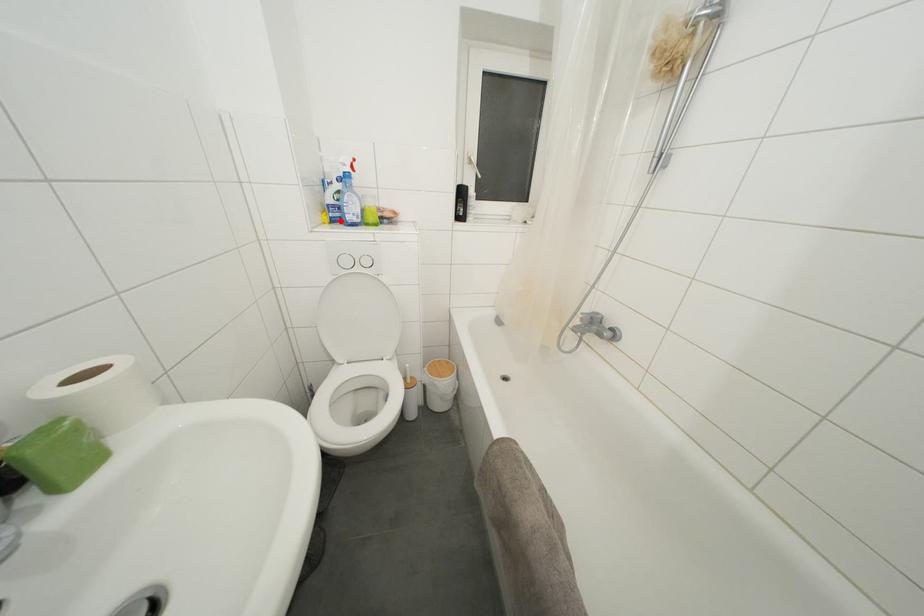
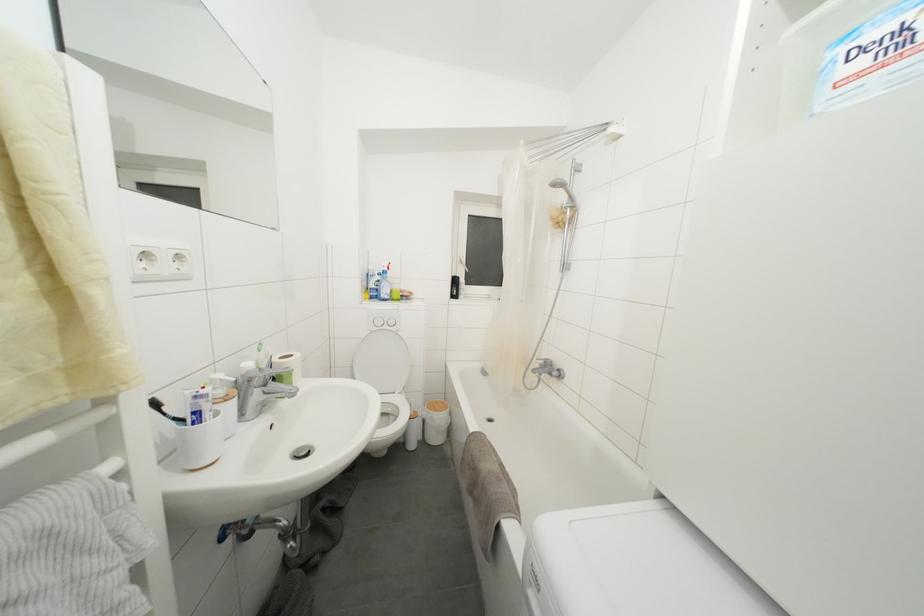
Find the pixel in the second image that matches the highlighted location in the first image.

(379, 300)